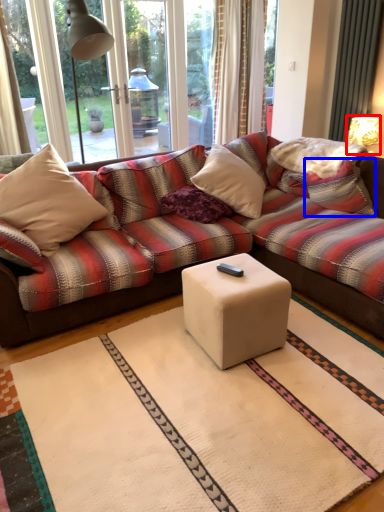
Question: Which point is closer to the camera, table lamp (highlighted by a red box) or pillow (highlighted by a blue box)?

Choices:
 (A) table lamp
 (B) pillow

Answer: (B)